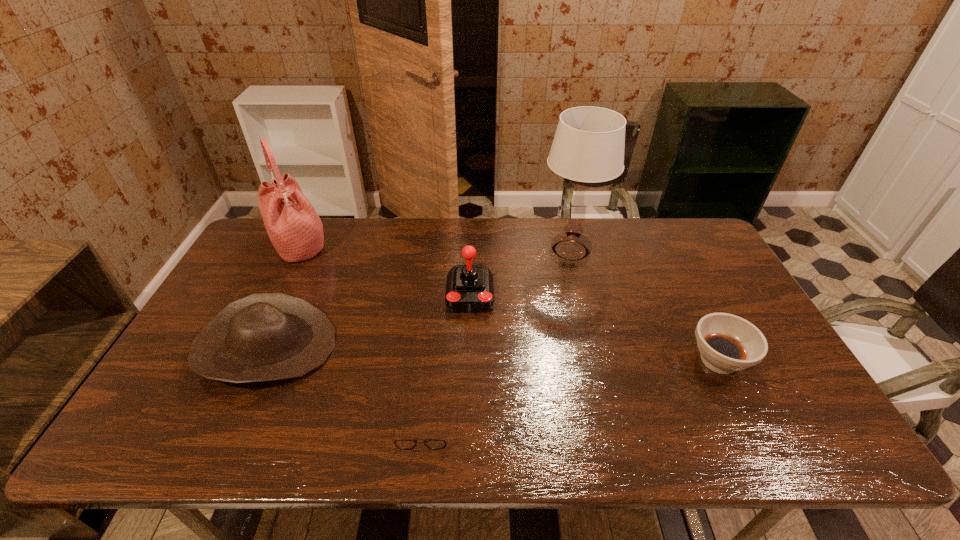
Image resolution: width=960 pixels, height=540 pixels. I want to click on the fifth object from left to right, so click(588, 147).

Locate an element on the screen. The width and height of the screenshot is (960, 540). table lamp is located at coordinates (588, 147).

Locate an element on the screen. The width and height of the screenshot is (960, 540). handbag is located at coordinates (295, 229).

Locate an element on the screen. joystick is located at coordinates (469, 288).

At what (x,y) coordinates should I click in order to perform the action: click on the third shortest object. Please return your answer as a coordinate pair (x, y). Looking at the image, I should click on click(265, 336).

At what (x,y) coordinates should I click in order to perform the action: click on soup bowl. Please return your answer as a coordinate pair (x, y). Looking at the image, I should click on (727, 343).

Locate an element on the screen. This screenshot has width=960, height=540. the fifth tallest object is located at coordinates (727, 343).

Locate an element on the screen. This screenshot has width=960, height=540. sunglasses is located at coordinates (406, 444).

Identify the location of free region located 0.260m on the front-facing side of the tallest object. This screenshot has height=540, width=960. (462, 250).

The image size is (960, 540). I want to click on free space located 0.140m on the front-facing side of the tallest object, so click(x=496, y=250).